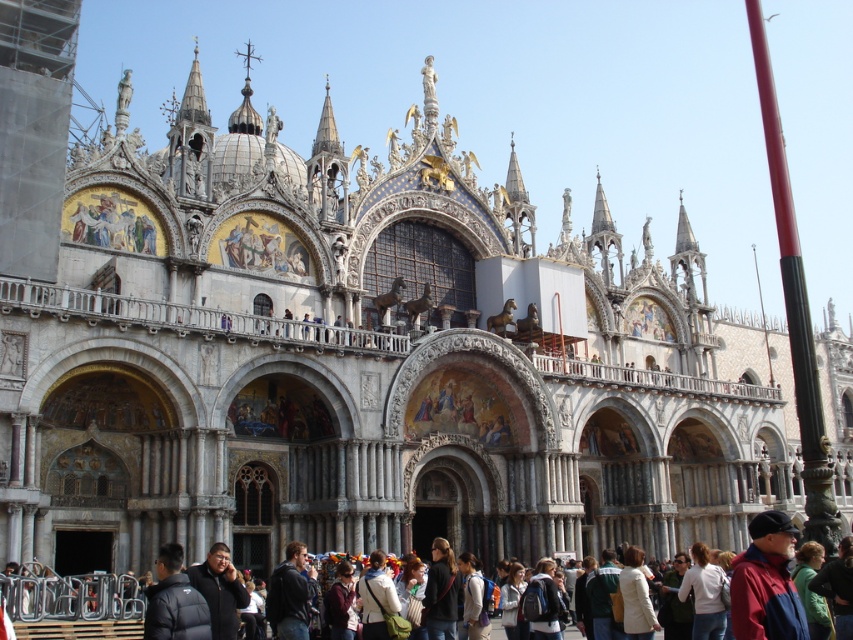
Who is lower down, white matte jacket at lower center or green fabric jacket at lower right?

Positioned lower is white matte jacket at lower center.

Does white matte jacket at lower center have a smaller size compared to green fabric jacket at lower right?

Incorrect, white matte jacket at lower center is not smaller in size than green fabric jacket at lower right.

Find the location of a particular element. Image resolution: width=853 pixels, height=640 pixels. white matte jacket at lower center is located at coordinates [636, 596].

Locate an element on the screen. This screenshot has height=640, width=853. white matte jacket at lower center is located at coordinates (636, 596).

The width and height of the screenshot is (853, 640). I want to click on dark gray hoodie at center, so click(x=440, y=593).

Image resolution: width=853 pixels, height=640 pixels. Describe the element at coordinates (440, 593) in the screenshot. I see `dark gray hoodie at center` at that location.

This screenshot has width=853, height=640. What are the coordinates of `dark gray hoodie at center` in the screenshot? It's located at (440, 593).

What do you see at coordinates (440, 593) in the screenshot? This screenshot has height=640, width=853. I see `dark gray hoodie at center` at bounding box center [440, 593].

Is dark gray hoodie at center taller than green fabric jacket at lower right?

Yes.

Where is `dark gray hoodie at center`? dark gray hoodie at center is located at coordinates (440, 593).